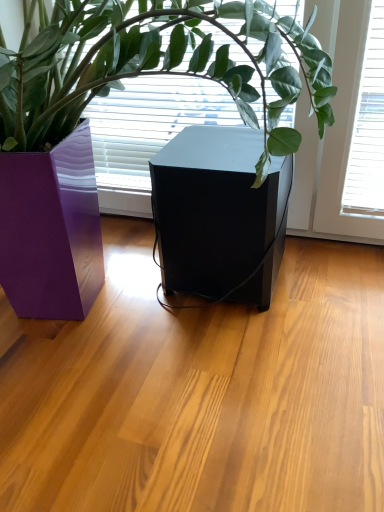
Question: Should I look upward or downward to see black matte speaker at center?

Choices:
 (A) up
 (B) down

Answer: (A)